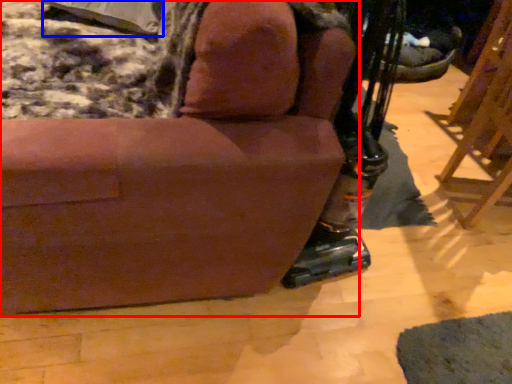
Question: Which of the following is the closest to the observer, chair (highlighted by a red box) or pillow (highlighted by a blue box)?

Choices:
 (A) chair
 (B) pillow

Answer: (A)